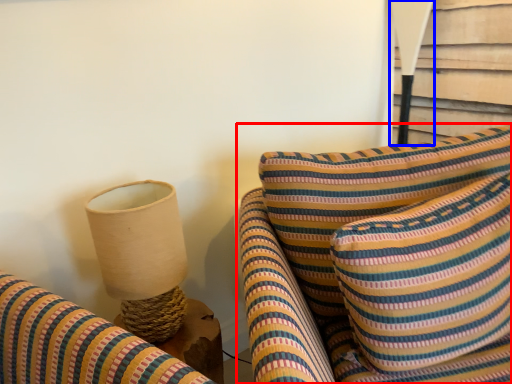
Question: Which object is closer to the camera taking this photo, furniture (highlighted by a red box) or table lamp (highlighted by a blue box)?

Choices:
 (A) furniture
 (B) table lamp

Answer: (A)